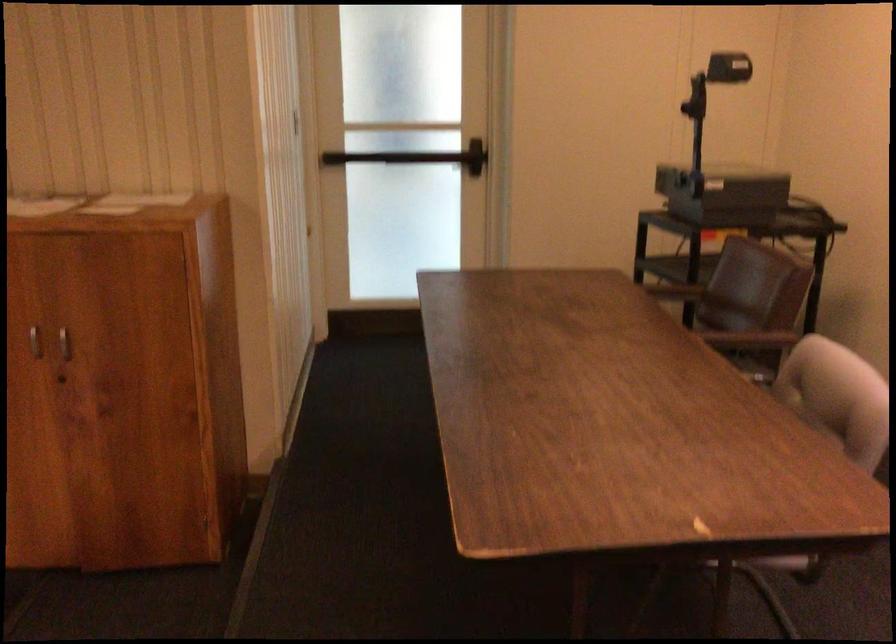
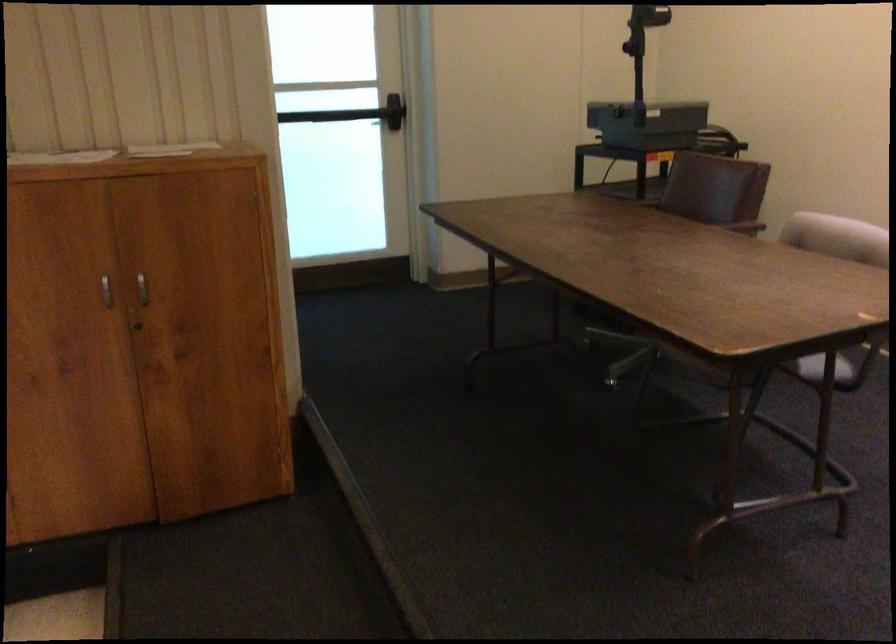
Question: The images are taken continuously from a first-person perspective. In which direction is your viewpoint rotating?

Choices:
 (A) Left
 (B) Right
 (C) Up
 (D) Down

Answer: (B)